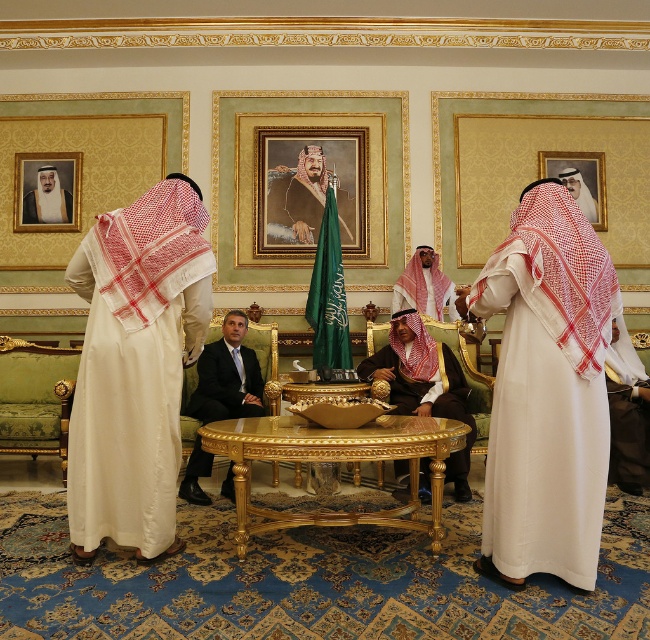
Consider the image. You are a photographer planning to take a group photo of the matte white robe at center and the white textured robe at center. Which robe should you position closer to the camera to ensure both appear equally sized in the photo?

You should position the white textured robe at center closer to the camera because the matte white robe at center is wider, so moving the smaller white textured robe at center forward will help balance their sizes in the photo.